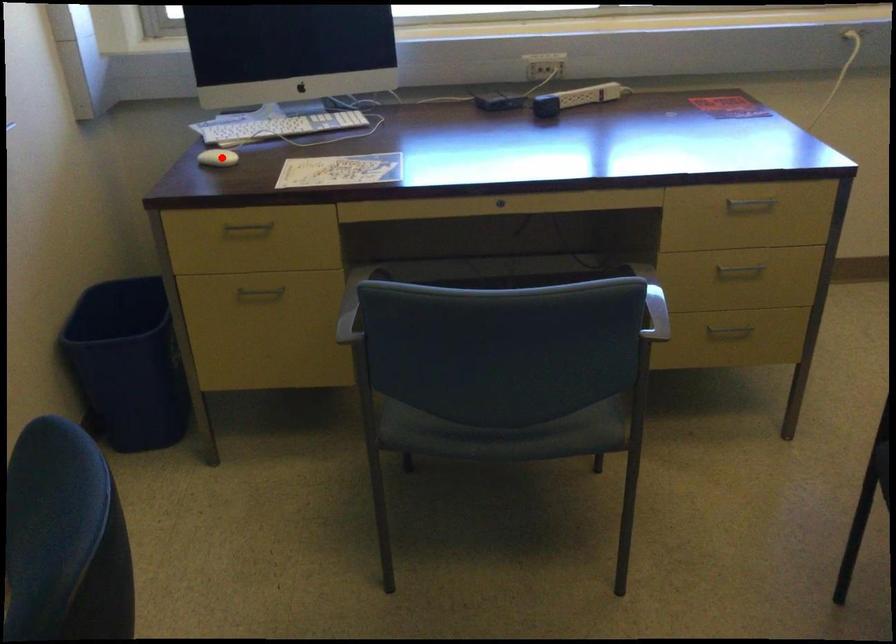
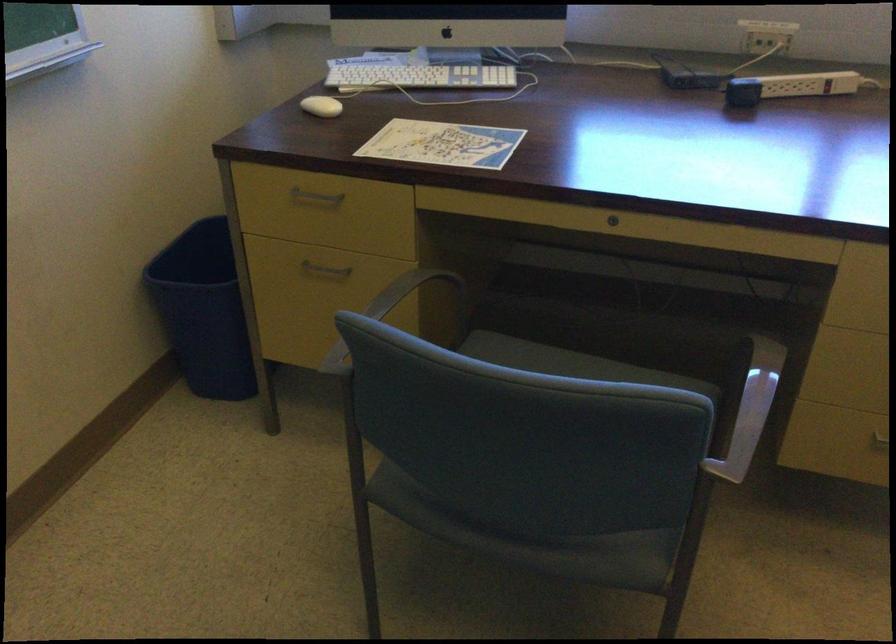
Where in the second image is the point corresponding to the highlighted location from the first image?

(321, 106)